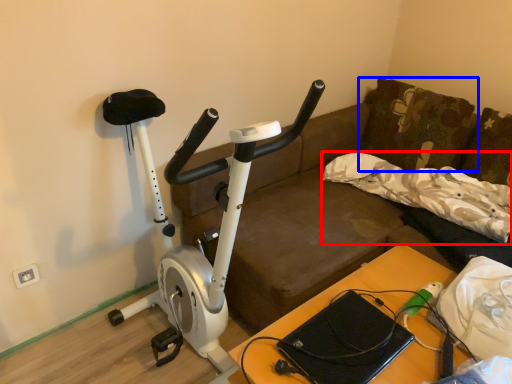
Question: Which object appears farthest to the camera in this image, pillow (highlighted by a red box) or pillow (highlighted by a blue box)?

Choices:
 (A) pillow
 (B) pillow

Answer: (B)